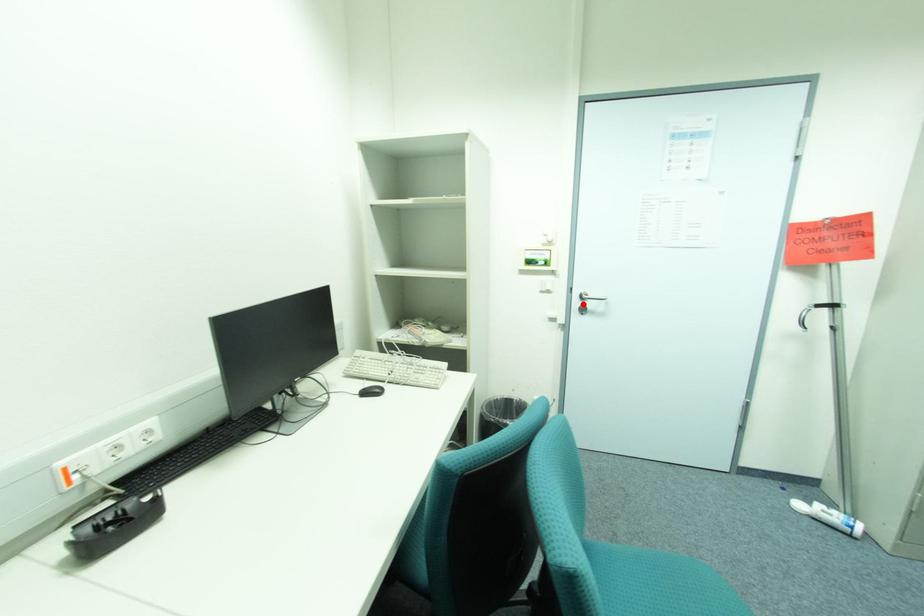
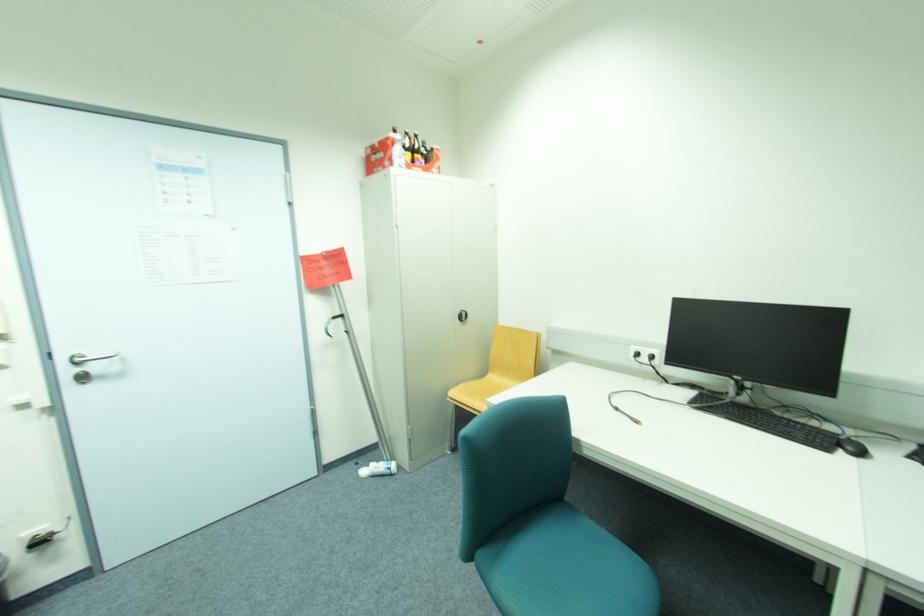
Question: I am providing you with two images of the same scene from different viewpoints. A red point is shown in image1. For the corresponding object point in image2, is it positioned nearer or farther from the camera?

Choices:
 (A) Nearer
 (B) Farther

Answer: (B)